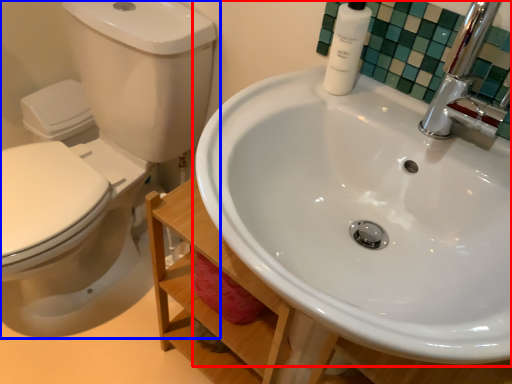
Question: Which object is closer to the camera taking this photo, sink (highlighted by a red box) or toilet (highlighted by a blue box)?

Choices:
 (A) sink
 (B) toilet

Answer: (A)